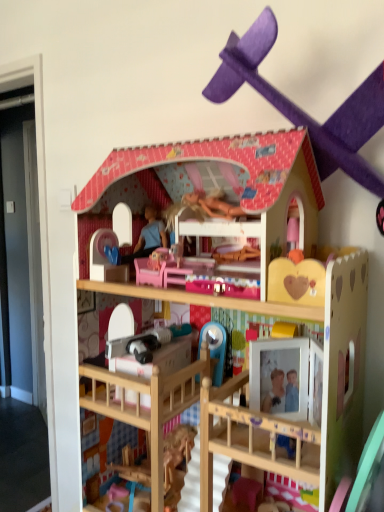
Question: From a real-world perspective, is purple cardboard airplane at upper center, the 2th toy from the bottom, under wooden dollhouse at center, which is the 2th toy from top to bottom?

Choices:
 (A) yes
 (B) no

Answer: (B)

Question: Is there a large distance between purple cardboard airplane at upper center, the 2th toy from the bottom, and wooden dollhouse at center, which appears as the 1th toy when ordered from the bottom?

Choices:
 (A) no
 (B) yes

Answer: (A)

Question: Is purple cardboard airplane at upper center, the 1th toy in the top-to-bottom sequence, further to the viewer compared to wooden dollhouse at center, which appears as the 1th toy when ordered from the bottom?

Choices:
 (A) no
 (B) yes

Answer: (A)

Question: From the image's perspective, is purple cardboard airplane at upper center, the 1th toy in the top-to-bottom sequence, located above wooden dollhouse at center, which appears as the 1th toy when ordered from the bottom?

Choices:
 (A) yes
 (B) no

Answer: (A)

Question: Does purple cardboard airplane at upper center, the 1th toy in the top-to-bottom sequence, have a larger size compared to wooden dollhouse at center, which appears as the 1th toy when ordered from the bottom?

Choices:
 (A) no
 (B) yes

Answer: (A)

Question: Would you say purple cardboard airplane at upper center, the 1th toy in the top-to-bottom sequence, is outside wooden dollhouse at center, which appears as the 1th toy when ordered from the bottom?

Choices:
 (A) yes
 (B) no

Answer: (A)

Question: From a real-world perspective, is wooden dollhouse at center, which is the 2th toy from top to bottom, on top of purple cardboard airplane at upper center, the 2th toy from the bottom?

Choices:
 (A) yes
 (B) no

Answer: (B)

Question: Considering the relative sizes of wooden dollhouse at center, which is the 2th toy from top to bottom, and purple cardboard airplane at upper center, the 2th toy from the bottom, in the image provided, is wooden dollhouse at center, which is the 2th toy from top to bottom, wider than purple cardboard airplane at upper center, the 2th toy from the bottom,?

Choices:
 (A) no
 (B) yes

Answer: (B)

Question: Is wooden dollhouse at center, which appears as the 1th toy when ordered from the bottom, placed right next to purple cardboard airplane at upper center, the 1th toy in the top-to-bottom sequence?

Choices:
 (A) yes
 (B) no

Answer: (B)

Question: From the image's perspective, is wooden dollhouse at center, which appears as the 1th toy when ordered from the bottom, located above purple cardboard airplane at upper center, the 2th toy from the bottom?

Choices:
 (A) yes
 (B) no

Answer: (B)

Question: Considering the relative sizes of wooden dollhouse at center, which is the 2th toy from top to bottom, and purple cardboard airplane at upper center, the 2th toy from the bottom, in the image provided, is wooden dollhouse at center, which is the 2th toy from top to bottom, thinner than purple cardboard airplane at upper center, the 2th toy from the bottom,?

Choices:
 (A) yes
 (B) no

Answer: (B)

Question: Can you confirm if wooden dollhouse at center, which is the 2th toy from top to bottom, is positioned to the right of purple cardboard airplane at upper center, the 2th toy from the bottom?

Choices:
 (A) yes
 (B) no

Answer: (B)

Question: From a real-world perspective, is wooden dollhouse at center, which is the 2th toy from top to bottom, physically located above or below purple cardboard airplane at upper center, the 1th toy in the top-to-bottom sequence?

Choices:
 (A) above
 (B) below

Answer: (B)